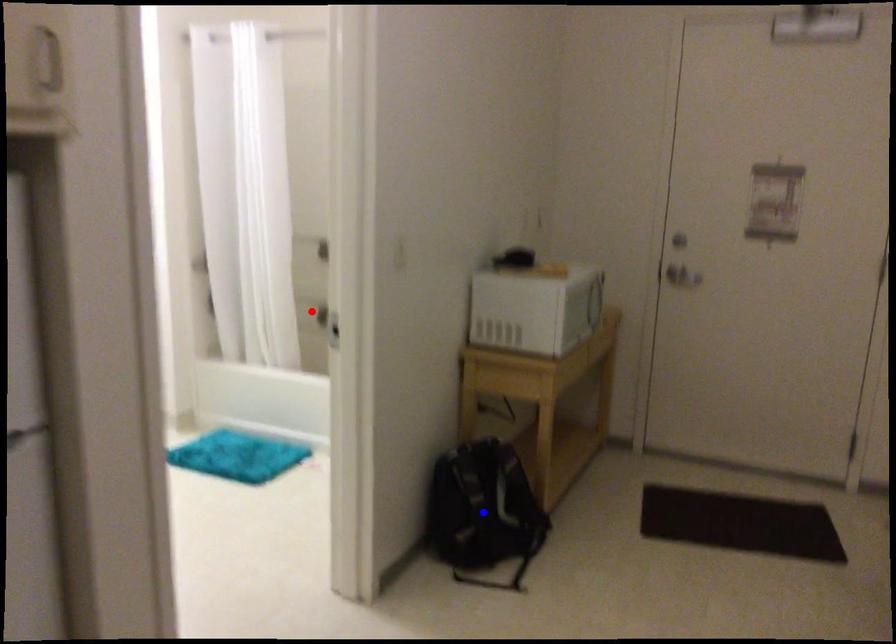
Question: Two points are marked on the image. Which point is closer to the camera?

Choices:
 (A) Blue point is closer.
 (B) Red point is closer.

Answer: (A)